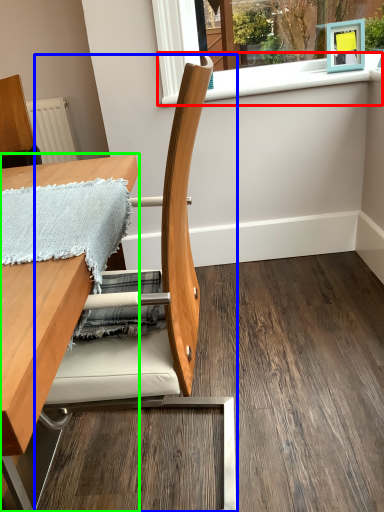
Question: Based on their relative distances, which object is farther from window sill (highlighted by a red box)? Choose from chair (highlighted by a blue box) and table (highlighted by a green box).

Choices:
 (A) chair
 (B) table

Answer: (A)